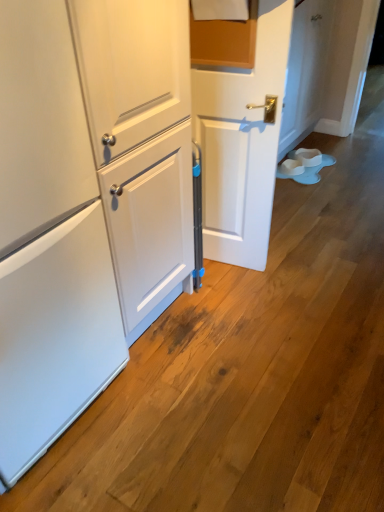
The image size is (384, 512). I want to click on space that is in front of white matte door at center, so click(x=237, y=295).